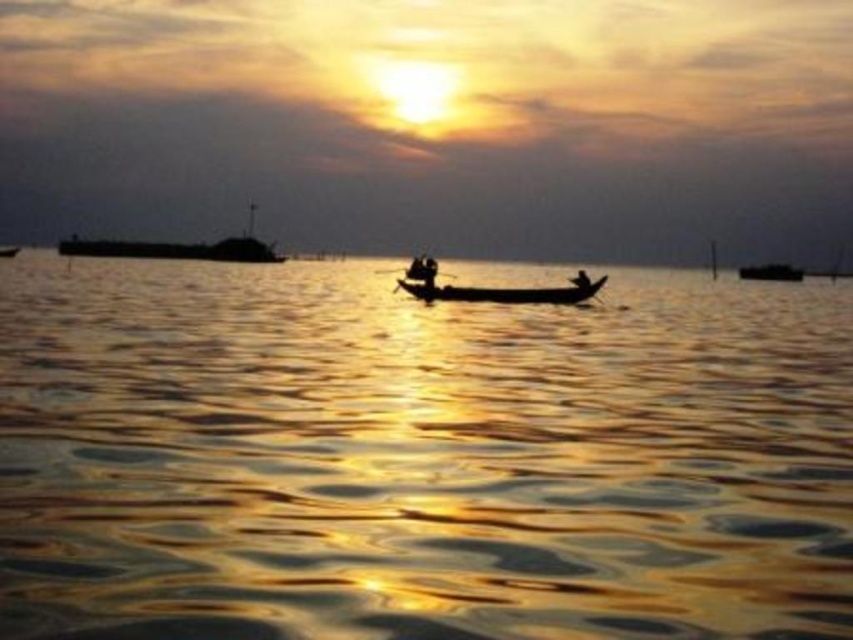
You are planning to take a boat ride on the lake. You see two boats available for use, the dark gray metallic boat at left and the dark matte boat at center. Which boat is bigger?

The dark gray metallic boat at left is larger in size compared to the dark matte boat at center.

You are standing at the edge of the water in the sunset scene. There is a point marked at coordinates point (418,456). What object is located at that point?

The point (418,456) is where the glistening golden water at center is located.